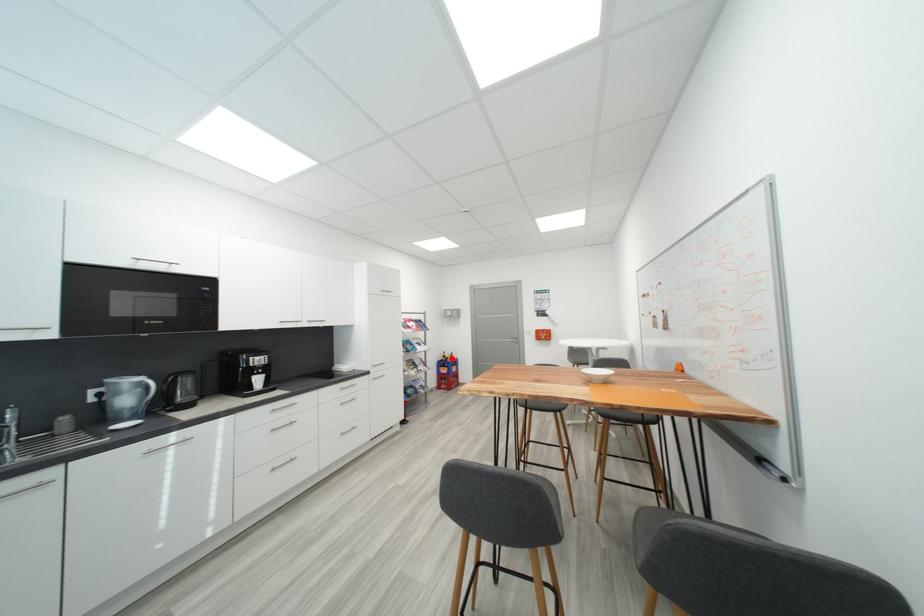
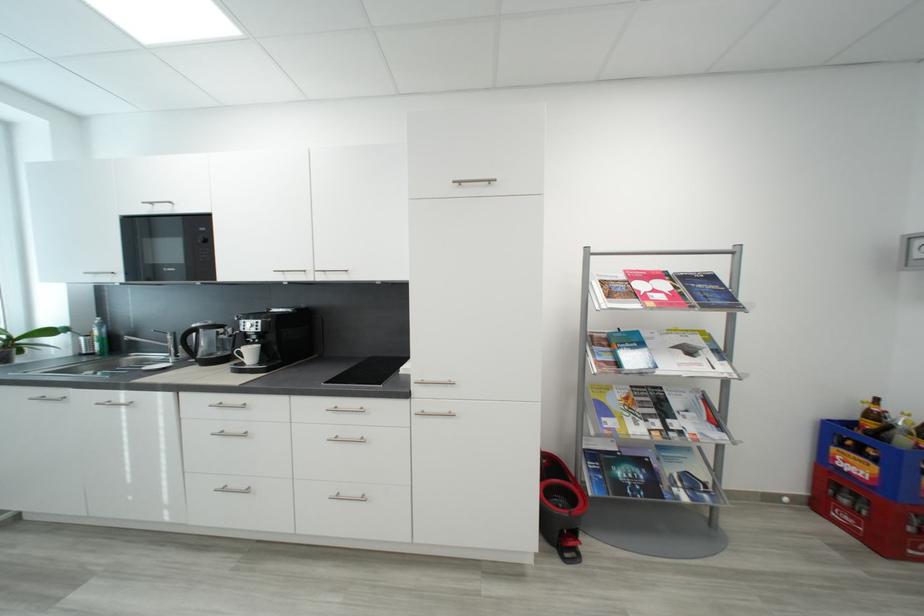
Where in the second image is the point corresponding to the highlighted location from the first image?

(881, 418)